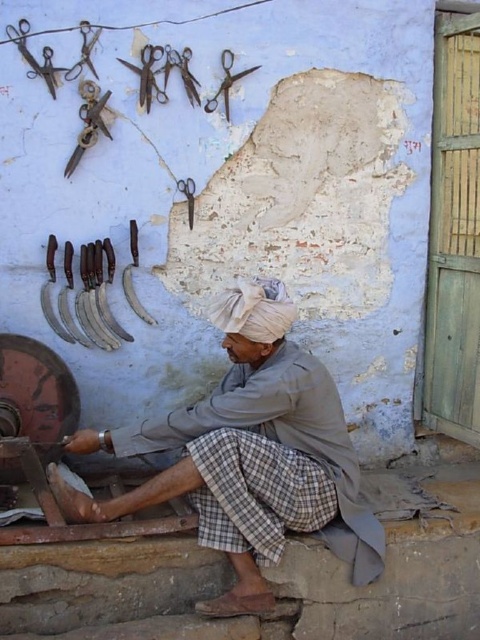
Which is in front, point (190, 97) or point (225, 84)?

Positioned in front is point (190, 97).

This screenshot has height=640, width=480. What do you see at coordinates (181, 72) in the screenshot?
I see `rusty metal scissors at upper center` at bounding box center [181, 72].

Is point (171, 65) in front of point (229, 80)?

That is True.

Find the location of a particular element. The height and width of the screenshot is (640, 480). rusty metal scissors at upper center is located at coordinates click(181, 72).

Between gray fabric turban at center and dark brown leather sickles at center, which one is positioned lower?

Positioned lower is gray fabric turban at center.

Who is taller, gray fabric turban at center or dark brown leather sickles at center?

With more height is gray fabric turban at center.

Where is `gray fabric turban at center`? gray fabric turban at center is located at coordinates (250, 454).

Does dark brown leather sickles at center appear under silver metallic scissors at upper left?

Correct, dark brown leather sickles at center is located below silver metallic scissors at upper left.

Is dark brown leather sickles at center to the left of silver metallic scissors at upper left from the viewer's perspective?

Yes, dark brown leather sickles at center is to the left of silver metallic scissors at upper left.

Locate an element on the screen. This screenshot has height=640, width=480. dark brown leather sickles at center is located at coordinates (84, 296).